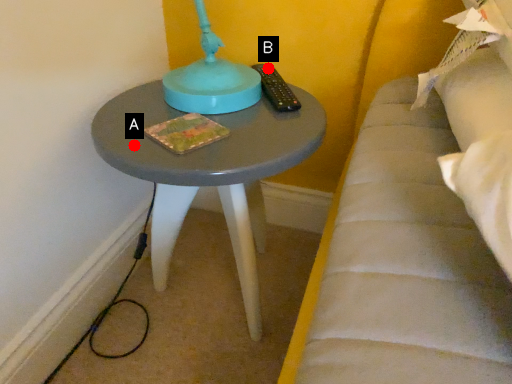
Question: Two points are circled on the image, labeled by A and B beside each circle. Which point is farther to the camera?

Choices:
 (A) A is further
 (B) B is further

Answer: (B)